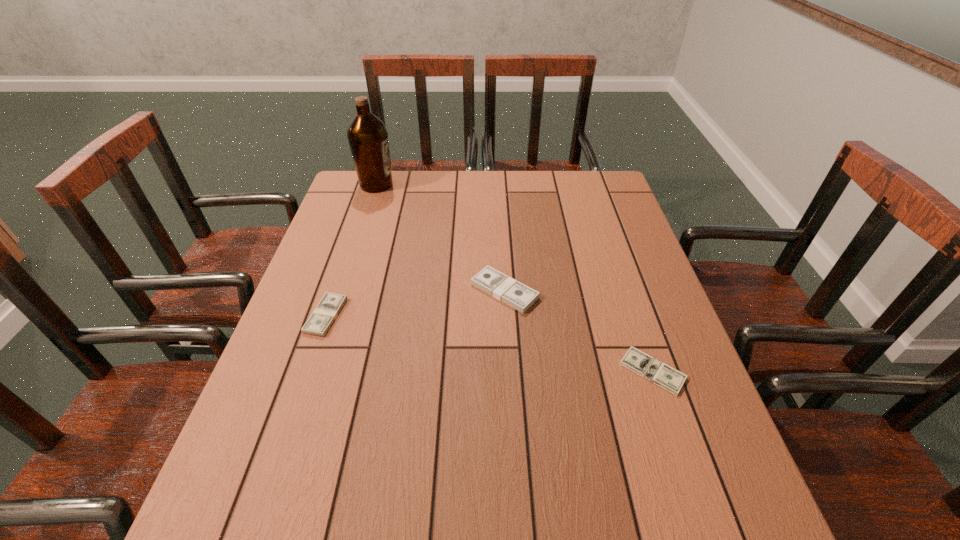
Where is `vacant space at the right edge of the desktop`? The width and height of the screenshot is (960, 540). vacant space at the right edge of the desktop is located at coordinates (617, 280).

In the image, there is a desktop. What are the coordinates of `vacant space at the far left corner` in the screenshot? It's located at (393, 174).

Image resolution: width=960 pixels, height=540 pixels. I want to click on free space at the far right corner of the desktop, so click(612, 191).

Identify the location of free spot between the shortest object and the tallest object. The height and width of the screenshot is (540, 960). (515, 278).

I want to click on free space that is in between the second shortest dollar and the farthest object, so click(x=351, y=250).

Locate an element on the screen. The height and width of the screenshot is (540, 960). free spot between the tallest object and the second shortest object is located at coordinates (351, 250).

Find the location of a particular element. The width and height of the screenshot is (960, 540). vacant space in between the tallest object and the nearest object is located at coordinates (515, 278).

Identify the location of free space between the second tallest dollar and the tallest object. tap(351, 250).

Locate an element on the screen. The image size is (960, 540). free spot between the second tallest dollar and the nearest object is located at coordinates (490, 343).

Find the location of a particular element. free space between the leftmost dollar and the farthest object is located at coordinates (351, 250).